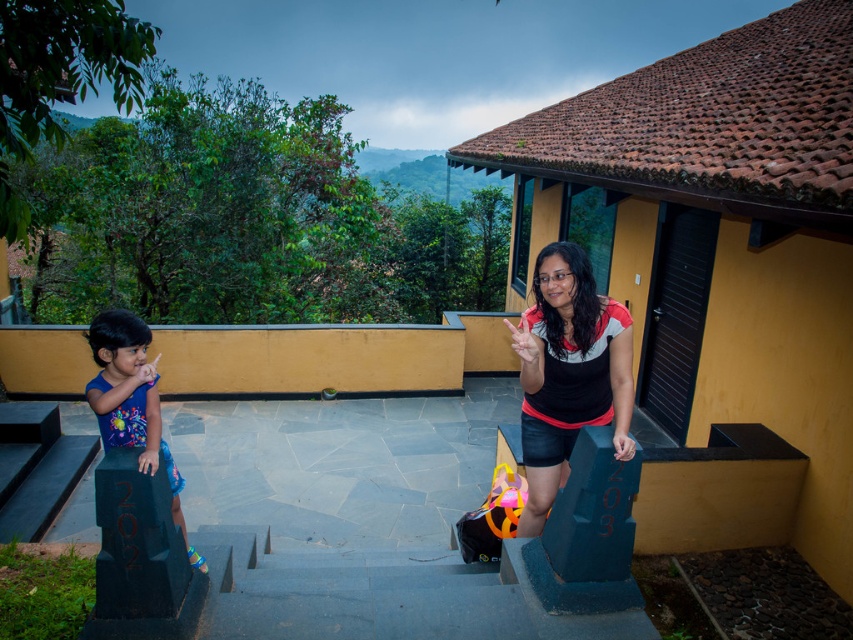
You are an architect designing a new terrace. You need to ensure that the black polished stone pillar at lower left and the matte blue dress at left are placed in a way that the pillar supports the dress. Is the current arrangement in the image suitable for this purpose?

Yes, the current arrangement is suitable because the black polished stone pillar at lower left is positioned under the matte blue dress at left, providing the necessary support.

You are standing on the terrace and want to take a photo of the matte black shirt at center without including the black polished stone pillar at lower left in the frame. Which direction should you move to ensure the pillar is out of view?

Move forward towards the matte black shirt at center so that the black polished stone pillar at lower left is no longer in the frame behind it.

From the picture: You are a delivery person carrying a package that requires a 2.5 meter clearance to pass between the black polished stone pillar at lower left and the other object. Will you be able to pass through without tilting the package?

The distance between the black polished stone pillar at lower left and the other object is 2.37 meters, which is less than the required 2.5 meters clearance. Therefore, you cannot pass through without tilting the package.